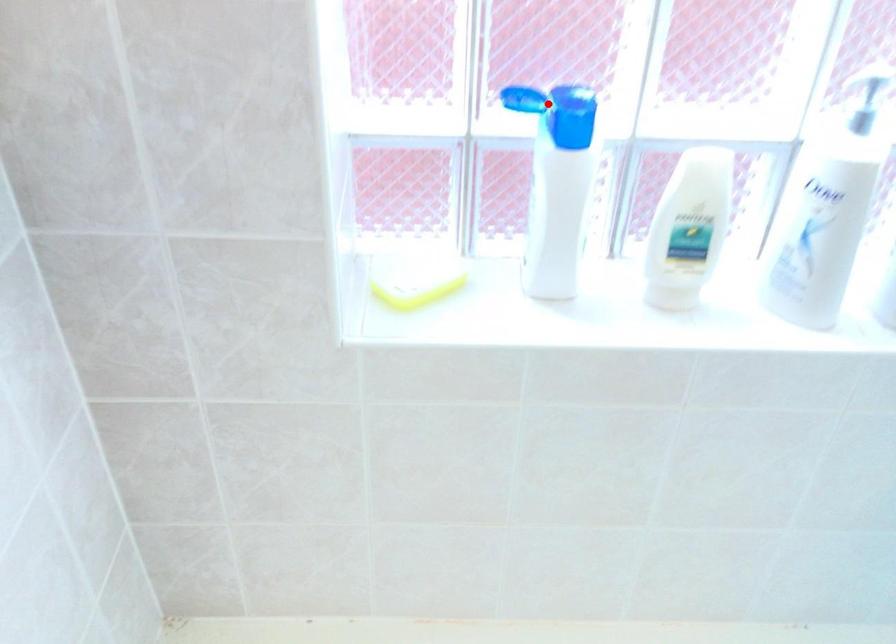
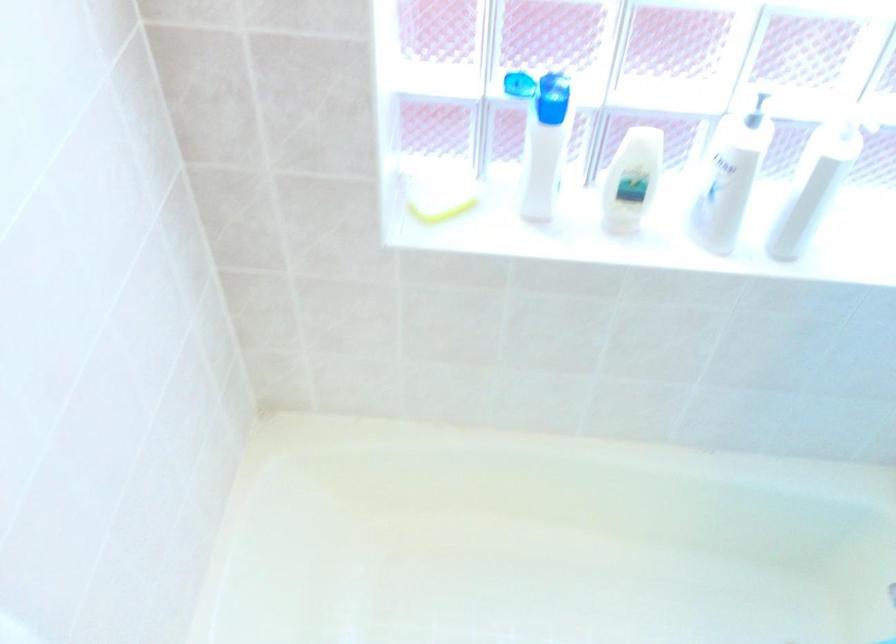
Find the pixel in the second image that matches the highlighted location in the first image.

(537, 88)